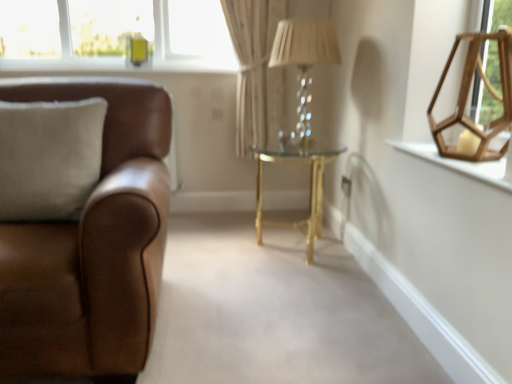
What is the approximate height of brown leather couch at left?

The height of brown leather couch at left is 34.78 inches.

Describe the element at coordinates (256, 71) in the screenshot. The width and height of the screenshot is (512, 384). I see `beige fabric curtain at center` at that location.

Measure the distance between point (x=253, y=127) and camera.

Point (x=253, y=127) and camera are 8.80 feet apart.

Identify the location of gold metallic side table at center. point(309,190).

How many degrees apart are the facing directions of beige fabric curtain at center and translucent glass table lamp at center?

90 degrees separate the facing orientations of beige fabric curtain at center and translucent glass table lamp at center.

The image size is (512, 384). In order to click on table lamp above the beige fabric curtain at center (from a real-world perspective) in this screenshot , I will do `click(304, 62)`.

How much distance is there between beige fabric curtain at center and translucent glass table lamp at center?

They are 21.89 inches apart.

Is beige fabric curtain at center aimed at translucent glass table lamp at center?

Yes, beige fabric curtain at center is aimed at translucent glass table lamp at center.

How many degrees apart are the facing directions of wooden hexagonal frame at upper right and brown leather couch at left?

The angle between the facing direction of wooden hexagonal frame at upper right and the facing direction of brown leather couch at left is 89.8 degrees.

Is wooden hexagonal frame at upper right bigger or smaller than brown leather couch at left?

wooden hexagonal frame at upper right is smaller than brown leather couch at left.

From their relative heights in the image, would you say wooden hexagonal frame at upper right is taller or shorter than brown leather couch at left?

Clearly, wooden hexagonal frame at upper right is shorter compared to brown leather couch at left.

Which object is positioned more to the left, wooden hexagonal frame at upper right or brown leather couch at left?

From the viewer's perspective, brown leather couch at left appears more on the left side.

From the image's perspective, is suede beige pillow at left beneath beige fabric curtain at center?

Yes, from the image's perspective, suede beige pillow at left is beneath beige fabric curtain at center.

Based on the photo, is beige fabric curtain at center at the back of suede beige pillow at left?

No, suede beige pillow at left is not facing away from beige fabric curtain at center.

Which object is closer to the camera, suede beige pillow at left or beige fabric curtain at center?

Positioned in front is suede beige pillow at left.

In the image, is suede beige pillow at left on the left side or the right side of beige fabric curtain at center?

From the image, it's evident that suede beige pillow at left is to the left of beige fabric curtain at center.

Considering the sizes of brown leather couch at left and suede beige pillow at left in the image, is brown leather couch at left bigger or smaller than suede beige pillow at left?

Clearly, brown leather couch at left is larger in size than suede beige pillow at left.

From a real-world perspective, is brown leather couch at left above or below suede beige pillow at left?

In terms of real-world spatial position, brown leather couch at left is below suede beige pillow at left.

Could you tell me if brown leather couch at left is facing suede beige pillow at left?

Yes, brown leather couch at left is aimed at suede beige pillow at left.

Which point is more forward, (131, 278) or (36, 214)?

The point (131, 278) is closer to the camera.

From a real-world perspective, does gold metallic side table at center stand above translucent glass table lamp at center?

Incorrect, from a real-world perspective, gold metallic side table at center is lower than translucent glass table lamp at center.

Based on their sizes in the image, would you say gold metallic side table at center is bigger or smaller than translucent glass table lamp at center?

gold metallic side table at center is bigger than translucent glass table lamp at center.

Based on the photo, from the image's perspective, which one is positioned higher, gold metallic side table at center or translucent glass table lamp at center?

translucent glass table lamp at center.

From a real-world perspective, is translucent glass table lamp at center located higher than beige fabric curtain at center?

Yes, from a real-world perspective, translucent glass table lamp at center is on top of beige fabric curtain at center.

Between translucent glass table lamp at center and beige fabric curtain at center, which one has larger width?

With larger width is translucent glass table lamp at center.

Is the position of translucent glass table lamp at center more distant than that of beige fabric curtain at center?

That is False.

Is translucent glass table lamp at center turned away from beige fabric curtain at center?

No, translucent glass table lamp at center's orientation is not away from beige fabric curtain at center.

Between beige fabric curtain at center and gold metallic side table at center, which one appears on the right side from the viewer's perspective?

gold metallic side table at center is more to the right.

Is beige fabric curtain at center located outside gold metallic side table at center?

beige fabric curtain at center is positioned outside gold metallic side table at center.

From the image's perspective, relative to gold metallic side table at center, is beige fabric curtain at center above or below?

beige fabric curtain at center is situated higher than gold metallic side table at center in the image.

Locate an element on the screen. Image resolution: width=512 pixels, height=384 pixels. table lamp located on the right of beige fabric curtain at center is located at coordinates (304, 62).

Find the location of a particular element. Image resolution: width=512 pixels, height=384 pixels. studio couch in front of the wooden hexagonal frame at upper right is located at coordinates (91, 245).

From the picture: Estimate the real-world distances between objects in this image. Which object is closer to suede beige pillow at left, wooden hexagonal frame at upper right or translucent glass table lamp at center?

The object closer to suede beige pillow at left is translucent glass table lamp at center.

Estimate the real-world distances between objects in this image. Which object is closer to gold metallic side table at center, brown leather couch at left or suede beige pillow at left?

The object closer to gold metallic side table at center is brown leather couch at left.

Looking at the image, which one is located further to translucent glass table lamp at center, wooden hexagonal frame at upper right or gold metallic side table at center?

Among the two, wooden hexagonal frame at upper right is located further to translucent glass table lamp at center.

Based on their spatial positions, is gold metallic side table at center or translucent glass table lamp at center closer to brown leather couch at left?

gold metallic side table at center is closer to brown leather couch at left.

In the scene shown: From the image, which object appears to be nearer to gold metallic side table at center, wooden hexagonal frame at upper right or beige fabric curtain at center?

The object closer to gold metallic side table at center is beige fabric curtain at center.

Based on their spatial positions, is gold metallic side table at center or beige fabric curtain at center further from translucent glass table lamp at center?

gold metallic side table at center lies further to translucent glass table lamp at center than the other object.

Looking at the image, which one is located closer to wooden hexagonal frame at upper right, gold metallic side table at center or suede beige pillow at left?

gold metallic side table at center is positioned closer to the anchor wooden hexagonal frame at upper right.

When comparing their distances from wooden hexagonal frame at upper right, does brown leather couch at left or beige fabric curtain at center seem further?

Answer: beige fabric curtain at center is positioned further to the anchor wooden hexagonal frame at upper right.

This screenshot has height=384, width=512. I want to click on table between brown leather couch at left and wooden hexagonal frame at upper right in the horizontal direction, so click(x=309, y=190).

You are a GUI agent. You are given a task and a screenshot of the screen. Output one action in this format:
    pyautogui.click(x=<x>, y=<y>)
    Task: Click on the table situated between suede beige pillow at left and wooden hexagonal frame at upper right from left to right
    
    Given the screenshot: What is the action you would take?
    (309, 190)

Identify the location of studio couch situated between suede beige pillow at left and wooden hexagonal frame at upper right from left to right. Image resolution: width=512 pixels, height=384 pixels. (91, 245).

You are a GUI agent. You are given a task and a screenshot of the screen. Output one action in this format:
    pyautogui.click(x=<x>, y=<y>)
    Task: Click on the table located between wooden hexagonal frame at upper right and translucent glass table lamp at center in the depth direction
    This screenshot has width=512, height=384.
    Given the screenshot: What is the action you would take?
    pyautogui.click(x=309, y=190)